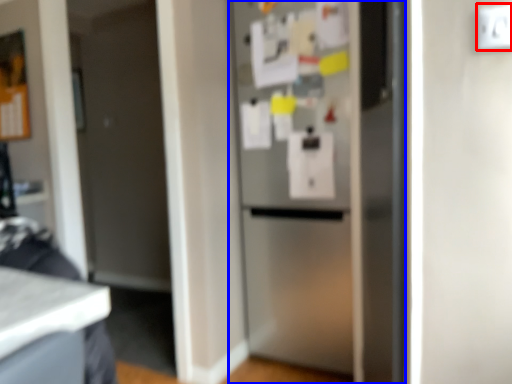
Question: Among these objects, which one is farthest to the camera, electric outlet (highlighted by a red box) or refrigerator (highlighted by a blue box)?

Choices:
 (A) electric outlet
 (B) refrigerator

Answer: (B)